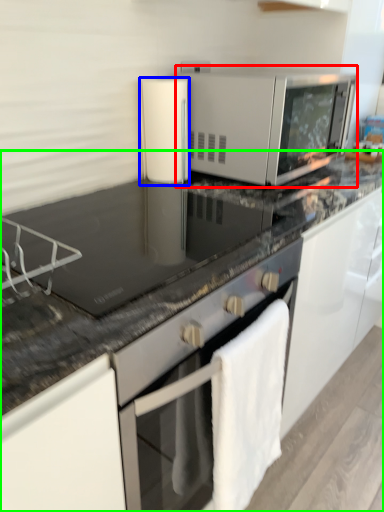
Question: Considering the real-world distances, which object is farthest from microwave oven (highlighted by a red box)? appliance (highlighted by a blue box) or countertop (highlighted by a green box)?

Choices:
 (A) appliance
 (B) countertop

Answer: (B)